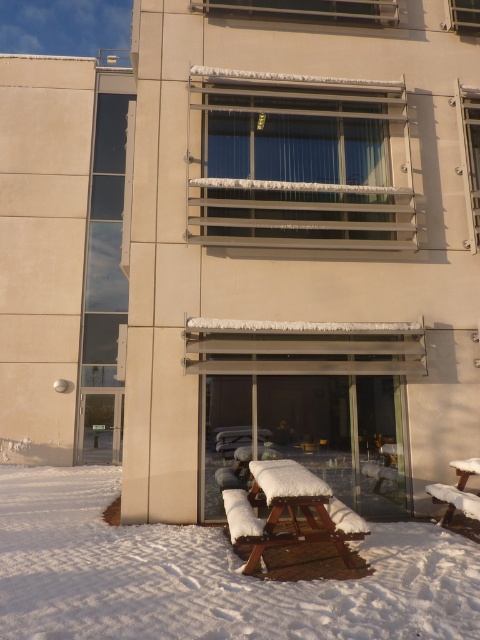
Question: Which point is closer to the camera?

Choices:
 (A) (326, 541)
 (B) (462, 488)

Answer: (A)

Question: Which of these objects is positioned farthest from the snow-covered wood picnic table at lower right?

Choices:
 (A) white wooden picnic table at lower center
 (B) wooden picnic table at lower center

Answer: (B)

Question: Does white wooden picnic table at lower center have a smaller size compared to snow-covered wood picnic table at lower right?

Choices:
 (A) no
 (B) yes

Answer: (A)

Question: Can you confirm if white wooden picnic table at lower center is positioned to the left of snow-covered wood picnic table at lower right?

Choices:
 (A) no
 (B) yes

Answer: (B)

Question: Which object appears closest to the camera in this image?

Choices:
 (A) snow-covered wood picnic table at lower right
 (B) white wooden picnic table at lower center
 (C) wooden picnic table at lower center

Answer: (B)

Question: Is white wooden picnic table at lower center to the left of wooden picnic table at lower center from the viewer's perspective?

Choices:
 (A) yes
 (B) no

Answer: (A)